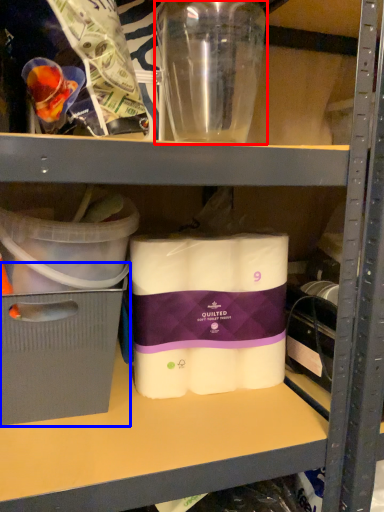
Question: Which object appears closest to the camera in this image, bottle (highlighted by a red box) or storage box (highlighted by a blue box)?

Choices:
 (A) bottle
 (B) storage box

Answer: (A)